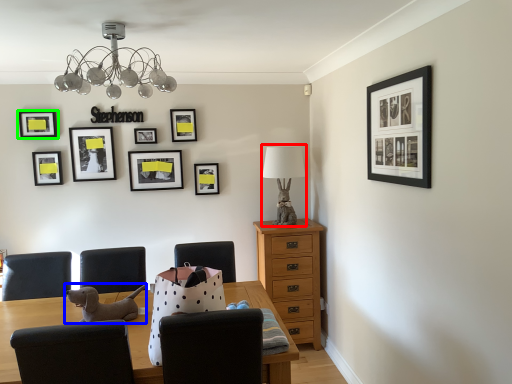
Question: Estimate the real-world distances between objects in this image. Which object is closer to table lamp (highlighted by a red box), animal (highlighted by a blue box) or picture frame (highlighted by a green box)?

Choices:
 (A) animal
 (B) picture frame

Answer: (A)